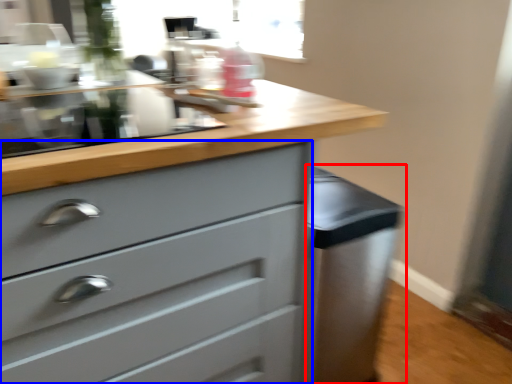
Question: Among these objects, which one is farthest to the camera, cabinetry (highlighted by a red box) or chest of drawers (highlighted by a blue box)?

Choices:
 (A) cabinetry
 (B) chest of drawers

Answer: (A)